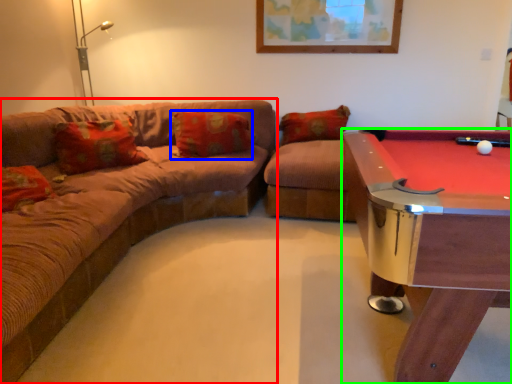
Question: Based on their relative distances, which object is nearer to studio couch (highlighted by a red box)? Choose from pillow (highlighted by a blue box) and billiard table (highlighted by a green box).

Choices:
 (A) pillow
 (B) billiard table

Answer: (A)